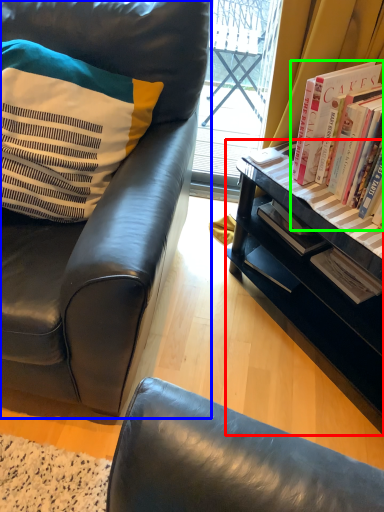
Question: Estimate the real-world distances between objects in this image. Which object is closer to desk (highlighted by a red box), chair (highlighted by a blue box) or book (highlighted by a green box)?

Choices:
 (A) chair
 (B) book

Answer: (B)